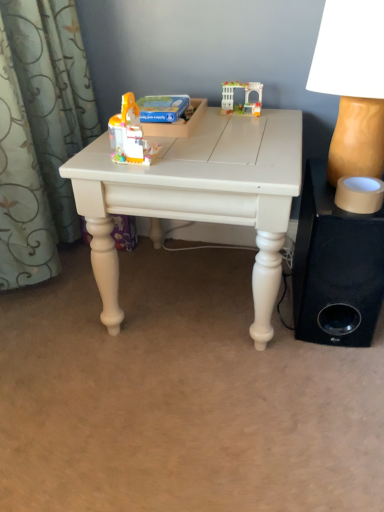
This screenshot has width=384, height=512. In order to click on vacant space to the left of translucent plastic toy at center, which is the 1th toy in left-to-right order in this screenshot , I will do `click(92, 157)`.